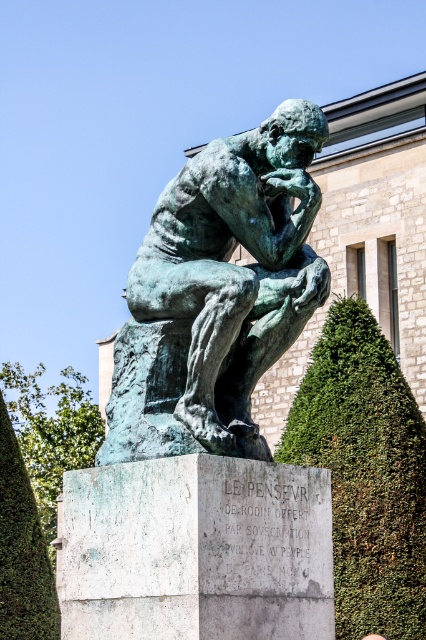
What is the spatial relationship between the green textured hedge at center right and the green leafy hedge at lower left in the image?

The green textured hedge at center right is positioned above the green leafy hedge at lower left.